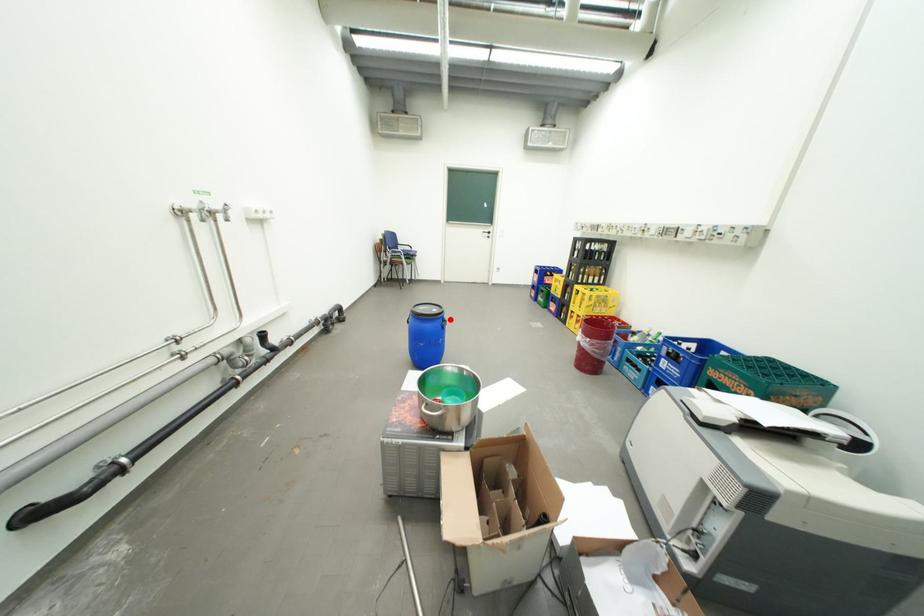
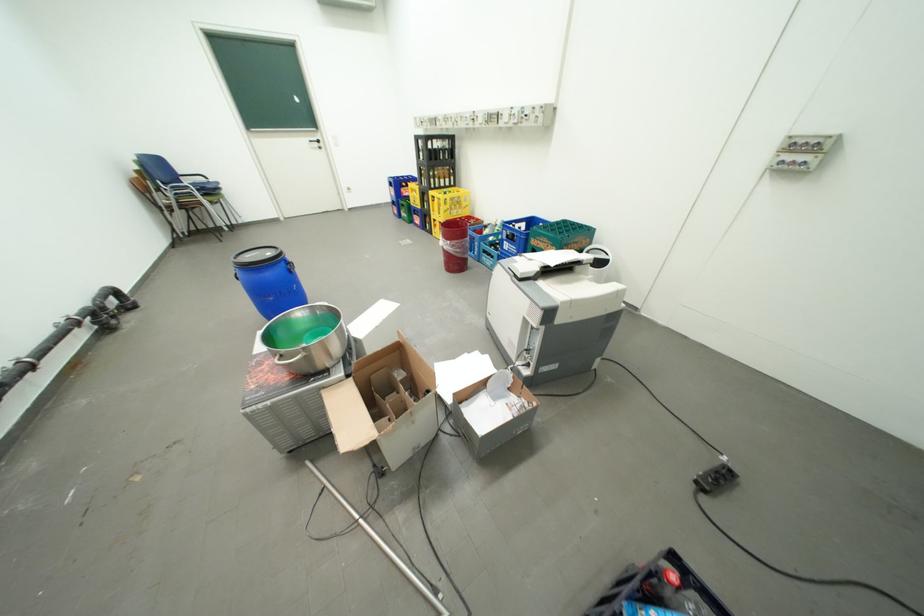
Question: I am providing you with two images of the same scene from different viewpoints. Given a red point in image1, look at the same physical point in image2. Is it:

Choices:
 (A) Closer to the viewpoint
 (B) Farther from the viewpoint

Answer: (A)